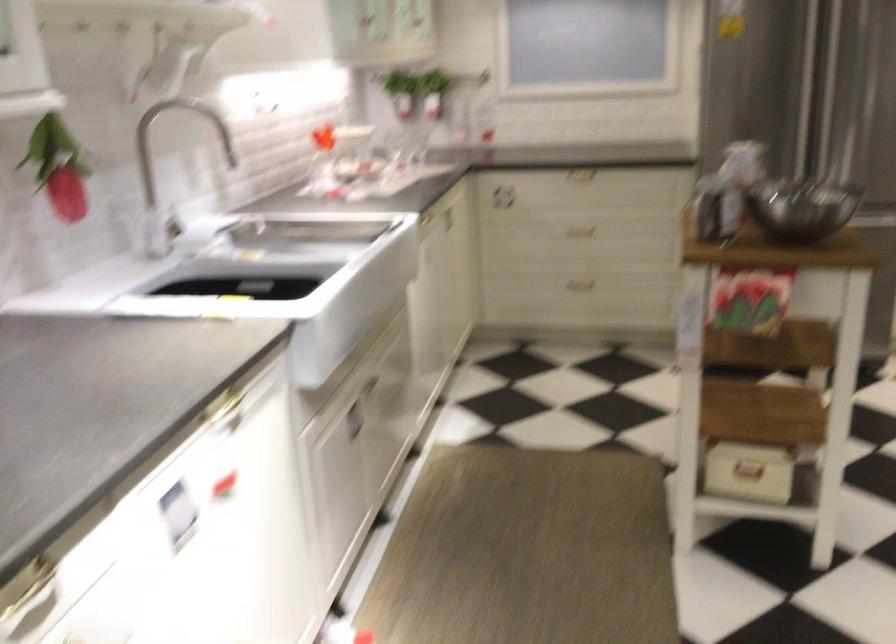
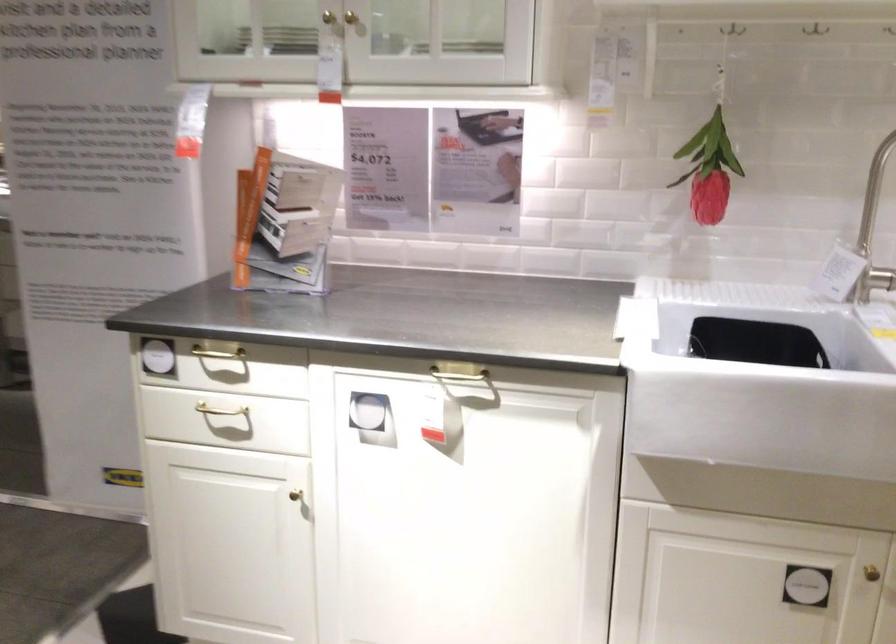
The point at (88, 169) is marked in the first image. Where is the corresponding point in the second image?

(709, 169)